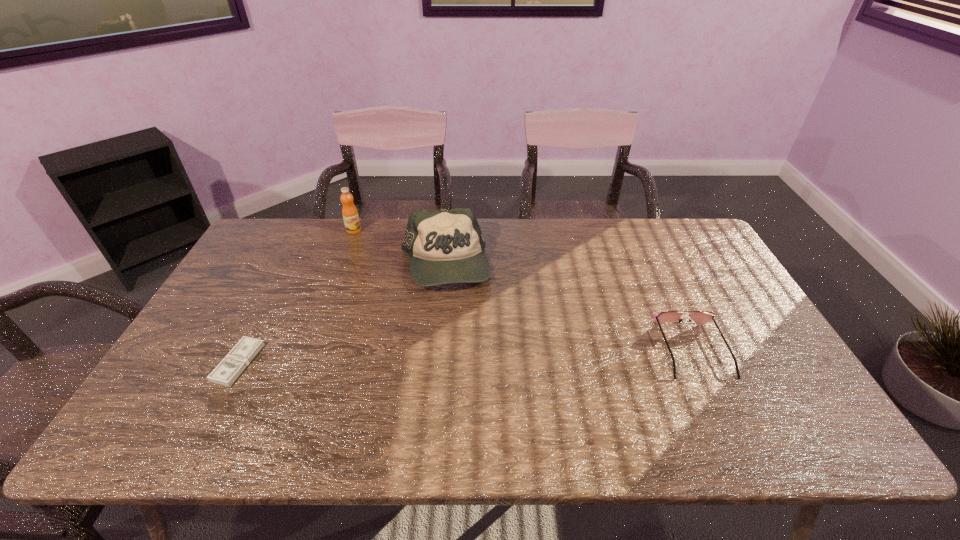
Find the location of a particular element. The width and height of the screenshot is (960, 540). the shortest object is located at coordinates (228, 370).

Where is `the leftmost object`? the leftmost object is located at coordinates (228, 370).

This screenshot has width=960, height=540. Find the location of `sunglasses`. sunglasses is located at coordinates (699, 317).

Where is `the rightmost object`? the rightmost object is located at coordinates (699, 317).

Locate an element on the screen. This screenshot has height=540, width=960. the third object from left to right is located at coordinates (445, 247).

The width and height of the screenshot is (960, 540). I want to click on baseball cap, so click(x=445, y=247).

The height and width of the screenshot is (540, 960). Identify the location of the tallest object. (350, 215).

At what (x,y) coordinates should I click in order to perform the action: click on the second object from left to right. Please return your answer as a coordinate pair (x, y). This screenshot has width=960, height=540. Looking at the image, I should click on (350, 215).

Image resolution: width=960 pixels, height=540 pixels. Find the location of `free space located 0.060m on the back of the shortest object`. free space located 0.060m on the back of the shortest object is located at coordinates (258, 324).

This screenshot has width=960, height=540. In order to click on blank space located on the bridge of the sunglasses in this screenshot , I will do `click(717, 401)`.